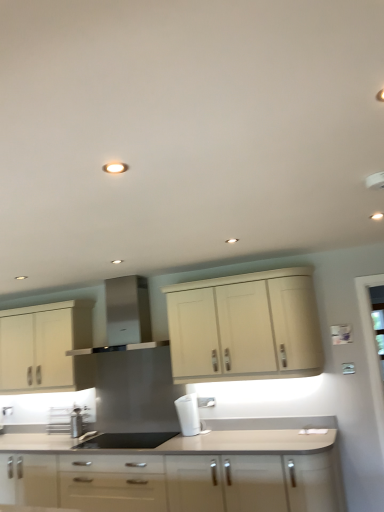
Question: Visually, is metallic stainless steel spice rack at lower left positioned to the left or to the right of white plastic coffee machine at center?

Choices:
 (A) left
 (B) right

Answer: (A)

Question: From the image's perspective, is metallic stainless steel spice rack at lower left positioned above or below white plastic coffee machine at center?

Choices:
 (A) below
 (B) above

Answer: (A)

Question: Based on their relative distances, which object is farther from the matte white cabinets at center, marked as the third cabinetry in a top-to-bottom arrangement?

Choices:
 (A) matte cream cabinet at upper center, positioned as the third cabinetry in bottom-to-top order
 (B) metallic stainless steel spice rack at lower left
 (C) matte cream cabinet at left, which is the second cabinetry from bottom to top
 (D) stainless steel range hood at center
 (E) white plastic coffee machine at center

Answer: (D)

Question: Which is farther from the black matte sink at center?

Choices:
 (A) white plastic coffee machine at center
 (B) matte white cabinets at center, marked as the third cabinetry in a top-to-bottom arrangement
 (C) matte cream cabinet at left, which is the second cabinetry from bottom to top
 (D) stainless steel range hood at center
 (E) metallic stainless steel spice rack at lower left

Answer: (D)